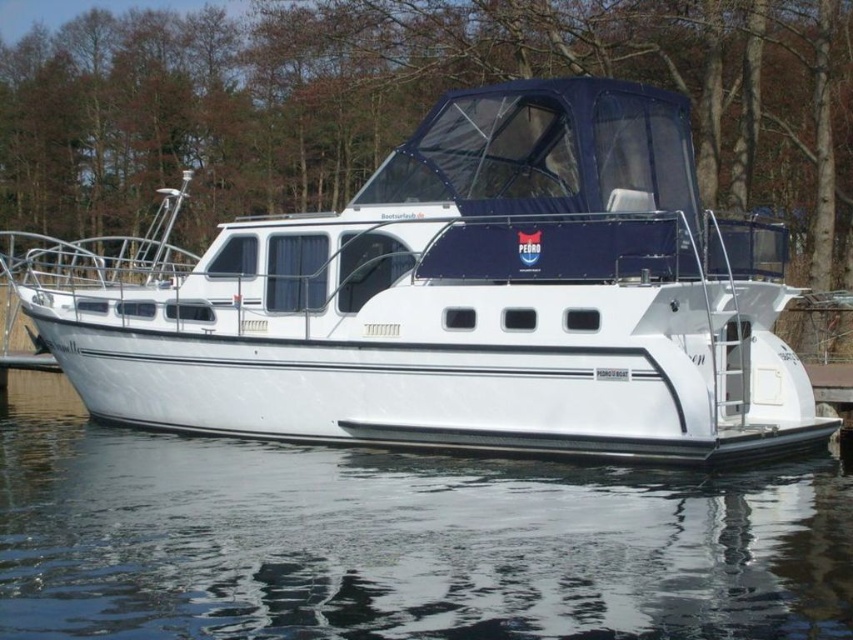
Question: Which object is farther from the camera taking this photo?

Choices:
 (A) transparent water at lower center
 (B) white glossy boat at center

Answer: (B)

Question: Which point is farther from the camera taking this photo?

Choices:
 (A) (506, 509)
 (B) (424, 248)

Answer: (B)

Question: In this image, where is white glossy boat at center located relative to transparent water at lower center?

Choices:
 (A) right
 (B) left

Answer: (B)

Question: In this image, where is white glossy boat at center located relative to transparent water at lower center?

Choices:
 (A) right
 (B) left

Answer: (B)

Question: In this image, where is white glossy boat at center located relative to transparent water at lower center?

Choices:
 (A) left
 (B) right

Answer: (A)